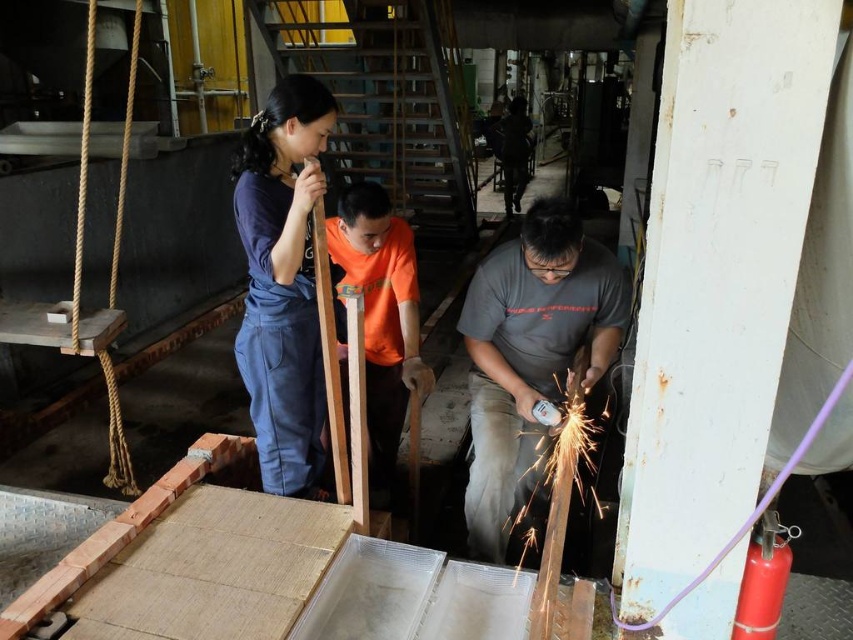
Question: Which of the following is the farthest from the observer?

Choices:
 (A) (363, 300)
 (B) (471, 435)

Answer: (B)

Question: Does matte gray shirt at center have a lesser width compared to orange cotton shirt at center?

Choices:
 (A) no
 (B) yes

Answer: (A)

Question: Which object is farther from the camera taking this photo?

Choices:
 (A) matte gray shirt at center
 (B) orange cotton shirt at center
 (C) dark blue denim jumpsuit at center

Answer: (B)

Question: Is matte gray shirt at center wider than dark blue denim jumpsuit at center?

Choices:
 (A) no
 (B) yes

Answer: (B)

Question: Considering the real-world distances, which object is closest to the dark blue denim jumpsuit at center?

Choices:
 (A) orange cotton shirt at center
 (B) matte gray shirt at center

Answer: (A)

Question: Is dark blue denim jumpsuit at center wider than orange cotton shirt at center?

Choices:
 (A) no
 (B) yes

Answer: (A)